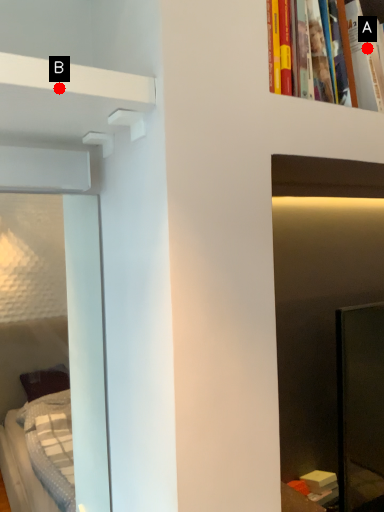
Question: Two points are circled on the image, labeled by A and B beside each circle. Which point is closer to the camera?

Choices:
 (A) A is closer
 (B) B is closer

Answer: (B)